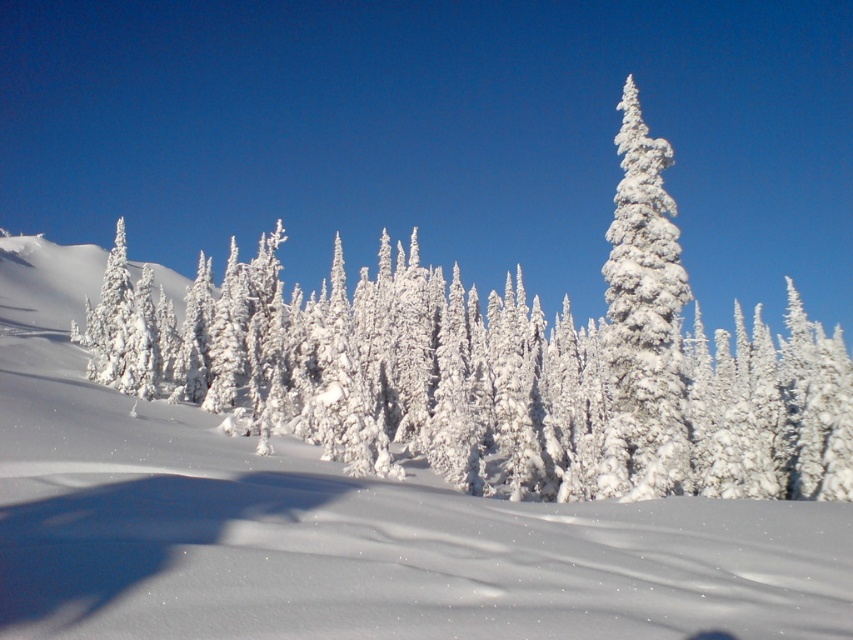
Image resolution: width=853 pixels, height=640 pixels. What do you see at coordinates (447, 570) in the screenshot?
I see `white fluffy snow at center` at bounding box center [447, 570].

This screenshot has width=853, height=640. Identify the location of white fluffy snow at center. (447, 570).

From the picture: Does white snow-covered tree at center have a greater width compared to white fluffy snow at center?

Indeed, white snow-covered tree at center has a greater width compared to white fluffy snow at center.

Which is more to the left, white snow-covered tree at center or white fluffy snow at center?

Positioned to the left is white fluffy snow at center.

I want to click on white snow-covered tree at center, so click(x=498, y=368).

Who is shorter, white snow-covered tree at center or white fluffy tree at center?

Standing shorter between the two is white snow-covered tree at center.

Identify the location of white snow-covered tree at center. This screenshot has width=853, height=640. (498, 368).